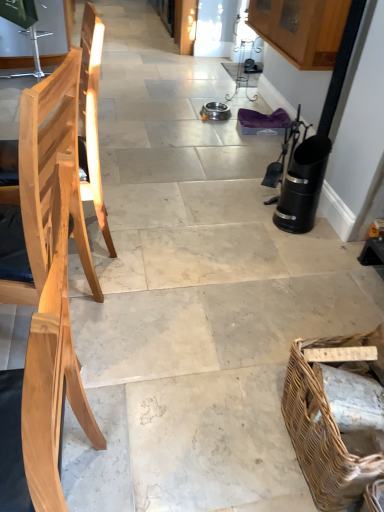
Question: Does natural wood chair at left, which ranks as the second chair in front-to-back order, have a lesser height compared to natural wood chair at left, the second chair when ordered from back to front?

Choices:
 (A) no
 (B) yes

Answer: (B)

Question: Considering the relative positions of natural wood chair at left, the 2th chair from the bottom, and natural wood chair at left, acting as the first chair starting from the bottom, in the image provided, is natural wood chair at left, the 2th chair from the bottom, to the right of natural wood chair at left, acting as the first chair starting from the bottom, from the viewer's perspective?

Choices:
 (A) no
 (B) yes

Answer: (A)

Question: Is natural wood chair at left, the 2th chair from the bottom, surrounding natural wood chair at left, the second chair when ordered from back to front?

Choices:
 (A) no
 (B) yes

Answer: (A)

Question: From the image's perspective, is natural wood chair at left, which ranks as the second chair in front-to-back order, under natural wood chair at left, the 1th chair when ordered from front to back?

Choices:
 (A) no
 (B) yes

Answer: (A)

Question: From a real-world perspective, is natural wood chair at left, the first chair positioned from the top, over natural wood chair at left, the 1th chair when ordered from front to back?

Choices:
 (A) no
 (B) yes

Answer: (A)

Question: Is brown woven picnic basket at lower right wider or thinner than natural wood chair at left, the 2th chair from the bottom?

Choices:
 (A) thin
 (B) wide

Answer: (B)

Question: Is brown woven picnic basket at lower right in front of or behind natural wood chair at left, marked as the first chair in a back-to-front arrangement, in the image?

Choices:
 (A) front
 (B) behind

Answer: (A)

Question: Considering the positions of point (289, 356) and point (82, 109), is point (289, 356) closer or farther from the camera than point (82, 109)?

Choices:
 (A) closer
 (B) farther

Answer: (A)

Question: In terms of height, does brown woven picnic basket at lower right look taller or shorter compared to natural wood chair at left, the first chair positioned from the top?

Choices:
 (A) short
 (B) tall

Answer: (A)

Question: From the image's perspective, is natural wood chair at left, the 1th chair when ordered from front to back, located above or below brown woven picnic basket at lower right?

Choices:
 (A) below
 (B) above

Answer: (B)

Question: Is natural wood chair at left, the second chair when ordered from back to front, in front of or behind brown woven picnic basket at lower right in the image?

Choices:
 (A) front
 (B) behind

Answer: (A)

Question: Considering the positions of point (61, 509) and point (304, 409), is point (61, 509) closer or farther from the camera than point (304, 409)?

Choices:
 (A) farther
 (B) closer

Answer: (B)

Question: Is natural wood chair at left, acting as the first chair starting from the bottom, situated inside brown woven picnic basket at lower right or outside?

Choices:
 (A) outside
 (B) inside

Answer: (A)

Question: Would you say natural wood chair at left, acting as the first chair starting from the bottom, is to the left or to the right of natural wood chair at left, marked as the first chair in a back-to-front arrangement, in the picture?

Choices:
 (A) right
 (B) left

Answer: (A)

Question: From a real-world perspective, relative to natural wood chair at left, marked as the first chair in a back-to-front arrangement, is natural wood chair at left, the 1th chair when ordered from front to back, vertically above or below?

Choices:
 (A) above
 (B) below

Answer: (A)